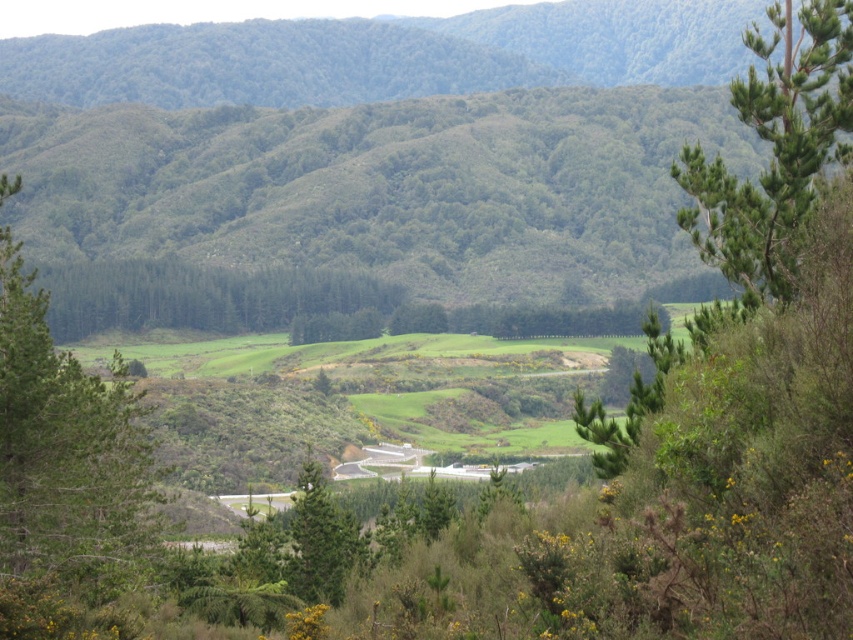
You are standing on the winding road and want to walk to the green matte forest at center. Which direction should you look to see the green leafy tree at left?

The green leafy tree at left is below the green matte forest at center, so you should look downward to see the green leafy tree at left.

You are a hiker standing at the start of the winding road in the middle ground. You see the green leafy tree at left and the green matte forest at center. Which of these two objects is closer to you?

The green leafy tree at left is closer to you because it is positioned in front of the green matte forest at center.